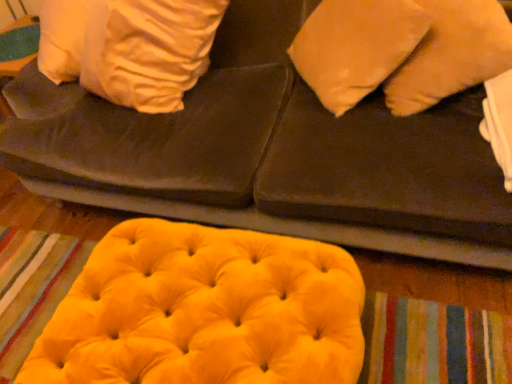
Question: In terms of height, does velvet yellow ottoman at lower center look taller or shorter compared to matte orange pillow at upper right?

Choices:
 (A) short
 (B) tall

Answer: (B)

Question: Considering the positions of velvet yellow ottoman at lower center and matte orange pillow at upper right in the image, is velvet yellow ottoman at lower center bigger or smaller than matte orange pillow at upper right?

Choices:
 (A) small
 (B) big

Answer: (B)

Question: Which is farther from the matte orange pillow at upper right?

Choices:
 (A) velvet yellow bean bag at lower center
 (B) velvet yellow ottoman at lower center

Answer: (A)

Question: Which object is the closest to the velvet yellow bean bag at lower center?

Choices:
 (A) velvet yellow ottoman at lower center
 (B) matte orange pillow at upper right

Answer: (A)